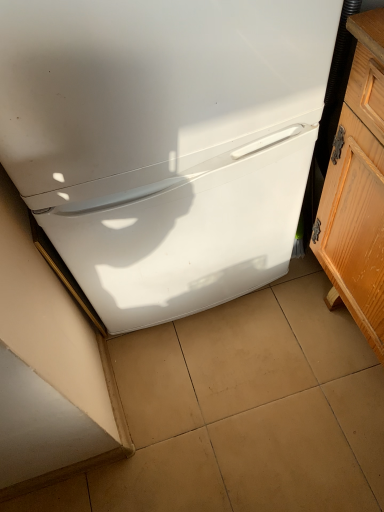
Question: Does white glossy refrigerator at center have a lesser width compared to wooden cabinet at right?

Choices:
 (A) no
 (B) yes

Answer: (A)

Question: Is white glossy refrigerator at center touching wooden cabinet at right?

Choices:
 (A) yes
 (B) no

Answer: (B)

Question: From a real-world perspective, is white glossy refrigerator at center beneath wooden cabinet at right?

Choices:
 (A) yes
 (B) no

Answer: (B)

Question: Is white glossy refrigerator at center smaller than wooden cabinet at right?

Choices:
 (A) yes
 (B) no

Answer: (B)

Question: Does white glossy refrigerator at center have a greater width compared to wooden cabinet at right?

Choices:
 (A) no
 (B) yes

Answer: (B)

Question: Is white glossy refrigerator at center positioned before wooden cabinet at right?

Choices:
 (A) yes
 (B) no

Answer: (B)

Question: Is wooden cabinet at right at the right side of beige tile at center?

Choices:
 (A) yes
 (B) no

Answer: (A)

Question: Considering the relative sizes of wooden cabinet at right and beige tile at center in the image provided, is wooden cabinet at right taller than beige tile at center?

Choices:
 (A) yes
 (B) no

Answer: (A)

Question: From the image's perspective, does wooden cabinet at right appear lower than beige tile at center?

Choices:
 (A) no
 (B) yes

Answer: (A)

Question: Is wooden cabinet at right to the left of beige tile at center from the viewer's perspective?

Choices:
 (A) yes
 (B) no

Answer: (B)

Question: Does wooden cabinet at right come behind beige tile at center?

Choices:
 (A) no
 (B) yes

Answer: (A)

Question: Can you see wooden cabinet at right touching beige tile at center?

Choices:
 (A) no
 (B) yes

Answer: (A)

Question: Does wooden cabinet at right have a greater height compared to white glossy refrigerator at center?

Choices:
 (A) no
 (B) yes

Answer: (A)